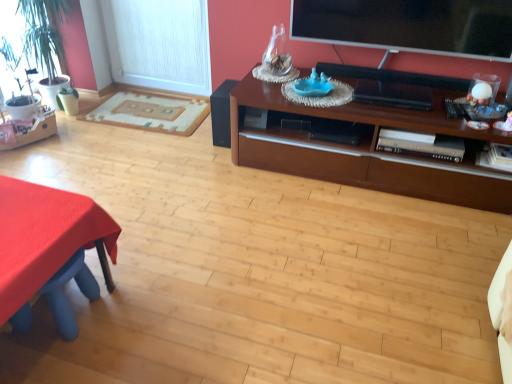
Where is `free space to the left of brown wood cabinet at upper right`? free space to the left of brown wood cabinet at upper right is located at coordinates (194, 196).